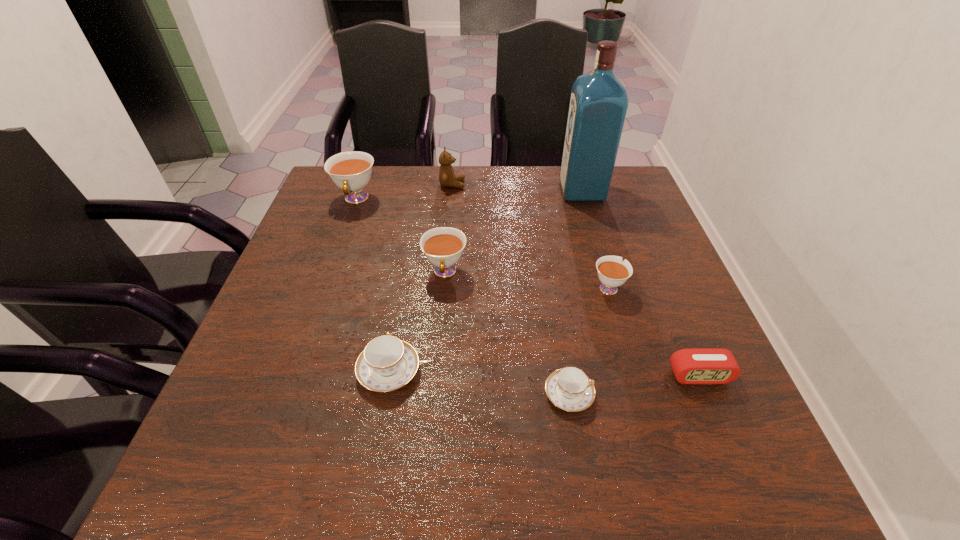
In the image, there is a desktop. At what (x,y) coordinates should I click in order to perform the action: click on vacant space at the right edge. Please return your answer as a coordinate pair (x, y). Image resolution: width=960 pixels, height=540 pixels. Looking at the image, I should click on (668, 349).

The height and width of the screenshot is (540, 960). Identify the location of unoccupied area between the bigger blue teacup and the leftmost teacup. (372, 285).

Where is `vacant region between the rightmost teacup and the right blue teacup`? vacant region between the rightmost teacup and the right blue teacup is located at coordinates (588, 341).

The height and width of the screenshot is (540, 960). In order to click on free space between the biggest white teacup and the shortest teacup in this screenshot , I will do `click(463, 296)`.

The image size is (960, 540). Find the location of `free point between the right blue teacup and the bigger blue teacup`. free point between the right blue teacup and the bigger blue teacup is located at coordinates (479, 382).

This screenshot has width=960, height=540. In order to click on vacant space that's between the rightmost teacup and the shortest teacup in this screenshot , I will do `click(588, 341)`.

You are a GUI agent. You are given a task and a screenshot of the screen. Output one action in this format:
    pyautogui.click(x=<x>, y=<y>)
    Task: Click on the vacant area that lies between the alarm clock and the smallest white teacup
    
    Given the screenshot: What is the action you would take?
    pyautogui.click(x=654, y=331)

Find the location of a particular element. This screenshot has width=960, height=540. free space that is in between the rightmost teacup and the tallest object is located at coordinates (595, 239).

This screenshot has height=540, width=960. What are the coordinates of `free area in between the teddy bear and the shortest object` in the screenshot? It's located at (511, 289).

At what (x,y) coordinates should I click in order to perform the action: click on free space that is in between the fourth shortest teacup and the shortest teacup. Please return your answer as a coordinate pair (x, y). The width and height of the screenshot is (960, 540). Looking at the image, I should click on (507, 333).